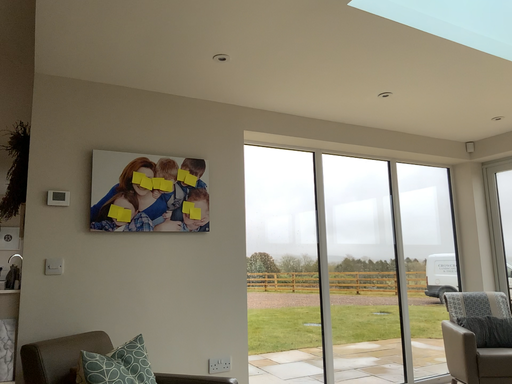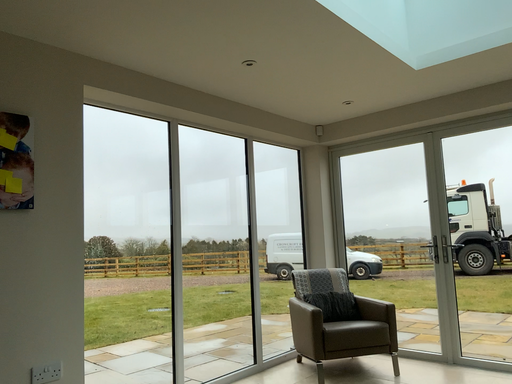
Question: How did the camera likely rotate when shooting the video?

Choices:
 (A) rotated right
 (B) rotated left

Answer: (A)